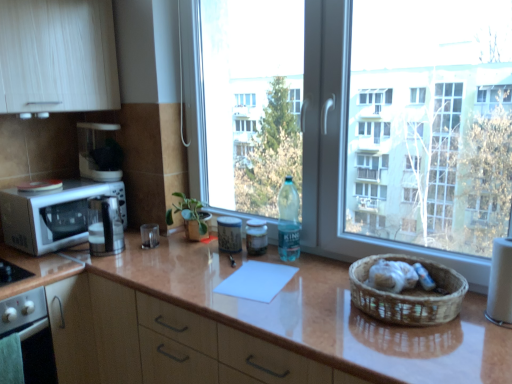
The image size is (512, 384). I want to click on free space in front of matte glass jar at center, the 2th appliance in the left-to-right sequence, so click(x=231, y=265).